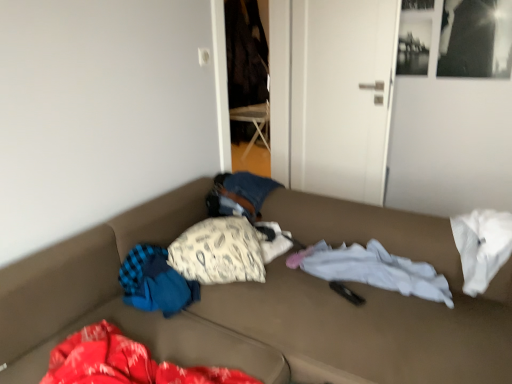
Describe the element at coordinates (268, 301) in the screenshot. The height and width of the screenshot is (384, 512). I see `brown fabric couch at center` at that location.

Locate an element on the screen. white fabric pillow at center is located at coordinates (219, 252).

This screenshot has width=512, height=384. Identify the location of white soft fabric at center. (373, 269).

I want to click on brown fabric couch at center, so click(268, 301).

Does white fabric pillow at center have a greater height compared to white soft fabric at center?

Correct, white fabric pillow at center is much taller as white soft fabric at center.

From a real-world perspective, which is physically above, white fabric pillow at center or white soft fabric at center?

In real-world perspective, white fabric pillow at center is above.

Considering the positions of point (179, 272) and point (437, 294), is point (179, 272) closer or farther from the camera than point (437, 294)?

Point (179, 272) appears to be farther away from the viewer than point (437, 294).

At what (x,y) coordinates should I click in order to perform the action: click on blanket in front of the white fabric pillow at center. Please return your answer as a coordinate pair (x, y). This screenshot has height=384, width=512. Looking at the image, I should click on (373, 269).

Can you tell me how much white matte door at center and white fabric pillow at center differ in facing direction?

122 degrees.

From the image's perspective, between white matte door at center and white fabric pillow at center, which one is located above?

white matte door at center, from the image's perspective.

Which is more to the left, white matte door at center or white fabric pillow at center?

white fabric pillow at center.

Considering the positions of points (330, 49) and (247, 231), is point (330, 49) closer to camera compared to point (247, 231)?

That is False.

Based on their sizes in the image, would you say white matte door at center is bigger or smaller than brown fabric couch at center?

Considering their sizes, white matte door at center takes up less space than brown fabric couch at center.

Does white matte door at center have a lesser height compared to brown fabric couch at center?

In fact, white matte door at center may be taller than brown fabric couch at center.

Looking at this image, from the image's perspective, which one is positioned higher, white matte door at center or brown fabric couch at center?

white matte door at center appears higher in the image.

Can you tell me how much white matte door at center and brown fabric couch at center differ in facing direction?

The angle between the facing direction of white matte door at center and the facing direction of brown fabric couch at center is 9.99 degrees.

Considering the positions of points (184, 262) and (33, 324), is point (184, 262) farther from camera compared to point (33, 324)?

Yes, it is.

In the image, is white fabric pillow at center on the left side or the right side of brown fabric couch at center?

white fabric pillow at center is positioned on brown fabric couch at center's left side.

From a real-world perspective, is white fabric pillow at center located higher than brown fabric couch at center?

Yes.

Is white fabric pillow at center in front of or behind brown fabric couch at center in the image?

white fabric pillow at center is positioned farther from the viewer than brown fabric couch at center.

Which of these two, brown fabric couch at center or white matte door at center, is wider?

With larger width is brown fabric couch at center.

Is brown fabric couch at center located outside white matte door at center?

Indeed, brown fabric couch at center is completely outside white matte door at center.

From a real-world perspective, who is located lower, brown fabric couch at center or white matte door at center?

brown fabric couch at center.

Is brown fabric couch at center beside white matte door at center?

No.

How distant is brown fabric couch at center from white soft fabric at center?

10.48 inches.

Identify the location of blanket that is above the brown fabric couch at center (from the image's perspective). (373, 269).

Are brown fabric couch at center and white soft fabric at center located far from each other?

That's not correct — brown fabric couch at center is a little close to white soft fabric at center.

Based on their sizes in the image, would you say brown fabric couch at center is bigger or smaller than white soft fabric at center?

Clearly, brown fabric couch at center is larger in size than white soft fabric at center.

Is the surface of white matte door at center in direct contact with white soft fabric at center?

No, white matte door at center is not with white soft fabric at center.

Can you tell me how much white matte door at center and white soft fabric at center differ in facing direction?

The angular difference between white matte door at center and white soft fabric at center is 17.9 degrees.

Locate an element on the screen. door behind the white soft fabric at center is located at coordinates 341,96.

Is white matte door at center turned away from white soft fabric at center?

No, white matte door at center's orientation is not away from white soft fabric at center.

There is a white soft fabric at center. Identify the location of pillow above it (from a real-world perspective). The height and width of the screenshot is (384, 512). (219, 252).

Locate an element on the screen. Image resolution: width=512 pixels, height=384 pixels. pillow located underneath the white matte door at center (from a real-world perspective) is located at coordinates (219, 252).

Estimate the real-world distances between objects in this image. Which object is closer to white soft fabric at center, white matte door at center or white fabric pillow at center?

white fabric pillow at center.

When comparing their distances from white fabric pillow at center, does brown fabric couch at center or white soft fabric at center seem further?

Based on the image, white soft fabric at center appears to be further to white fabric pillow at center.

Estimate the real-world distances between objects in this image. Which object is closer to white soft fabric at center, brown fabric couch at center or white fabric pillow at center?

brown fabric couch at center lies closer to white soft fabric at center than the other object.

Looking at the image, which one is located closer to white soft fabric at center, white matte door at center or brown fabric couch at center?

brown fabric couch at center lies closer to white soft fabric at center than the other object.

When comparing their distances from white soft fabric at center, does brown fabric couch at center or white matte door at center seem closer?

The object closer to white soft fabric at center is brown fabric couch at center.

From the image, which object appears to be nearer to white matte door at center, white soft fabric at center or white fabric pillow at center?

white soft fabric at center is closer to white matte door at center.

Estimate the real-world distances between objects in this image. Which object is further from brown fabric couch at center, white matte door at center or white soft fabric at center?

white matte door at center is further to brown fabric couch at center.

Considering their positions, is brown fabric couch at center positioned closer to white matte door at center than white fabric pillow at center?

brown fabric couch at center.

The width and height of the screenshot is (512, 384). Find the location of `blanket between brown fabric couch at center and white matte door at center in the front-back direction`. blanket between brown fabric couch at center and white matte door at center in the front-back direction is located at coordinates (373, 269).

Where is `pillow between white matte door at center and white soft fabric at center from top to bottom`? pillow between white matte door at center and white soft fabric at center from top to bottom is located at coordinates (219, 252).

Locate an element on the screen. The image size is (512, 384). pillow between brown fabric couch at center and white matte door at center in the front-back direction is located at coordinates (219, 252).

This screenshot has width=512, height=384. In order to click on blanket positioned between brown fabric couch at center and white fabric pillow at center from near to far in this screenshot , I will do `click(373, 269)`.